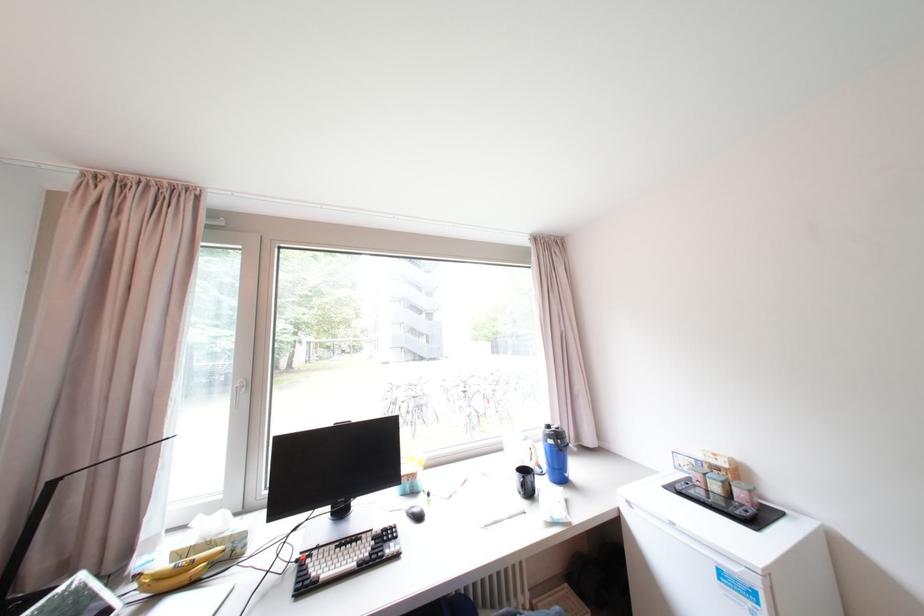
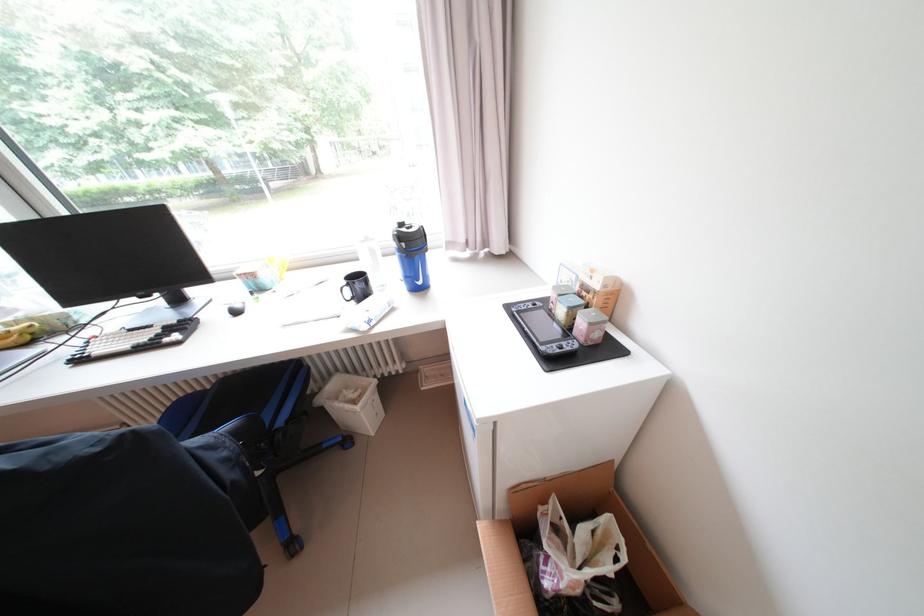
The point at (185, 554) is marked in the first image. Where is the corresponding point in the second image?

(15, 326)